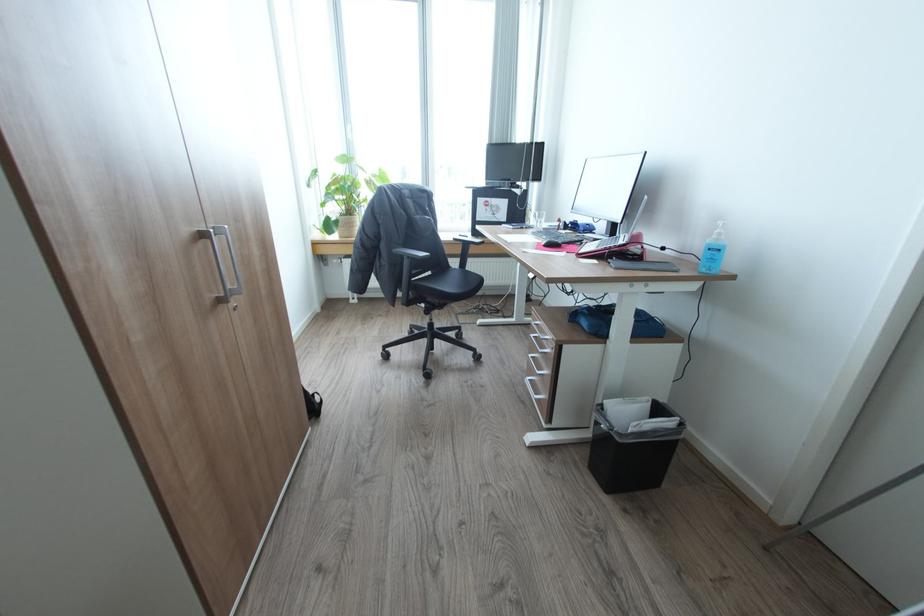
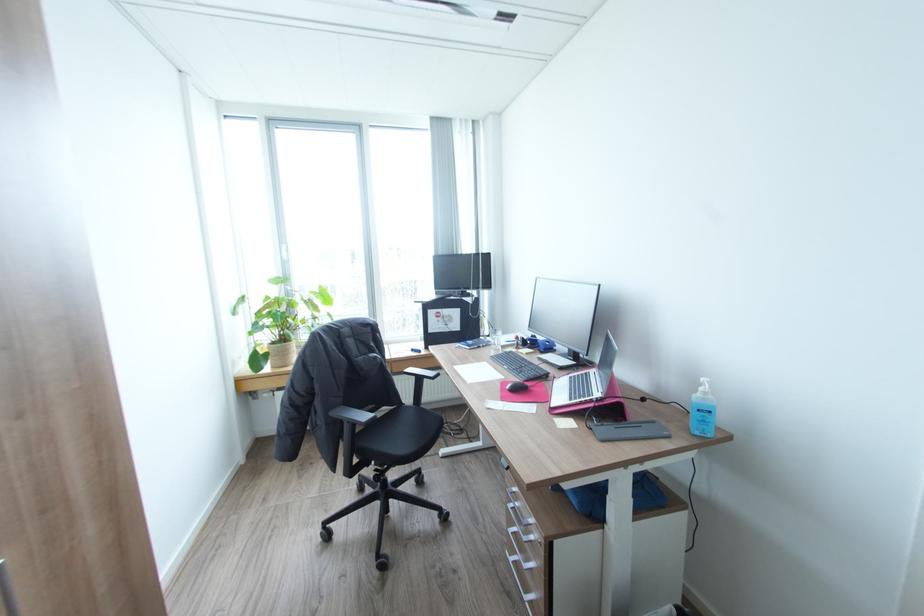
Locate, in the second image, the point that corresponds to point (551, 352) in the first image.

(536, 541)